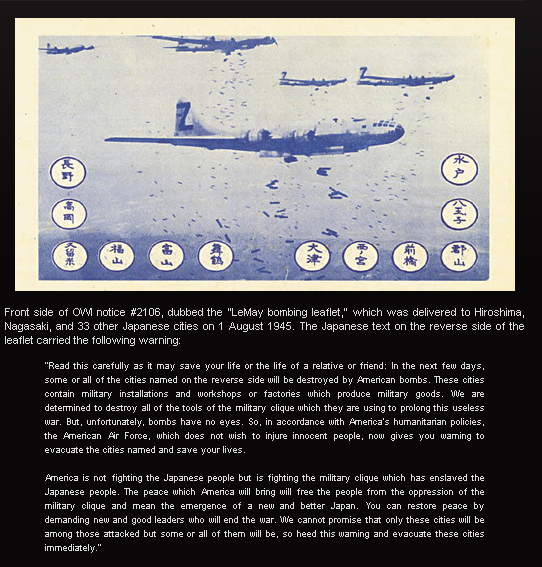
This screenshot has width=542, height=567. I want to click on cream colored border around photo, so click(x=21, y=192).